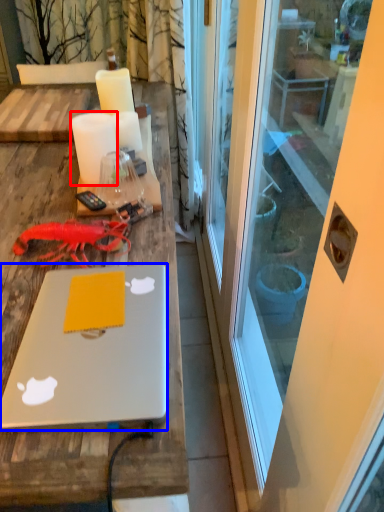
Question: Which object appears farthest to the camera in this image, candle (highlighted by a red box) or laptop (highlighted by a blue box)?

Choices:
 (A) candle
 (B) laptop

Answer: (A)